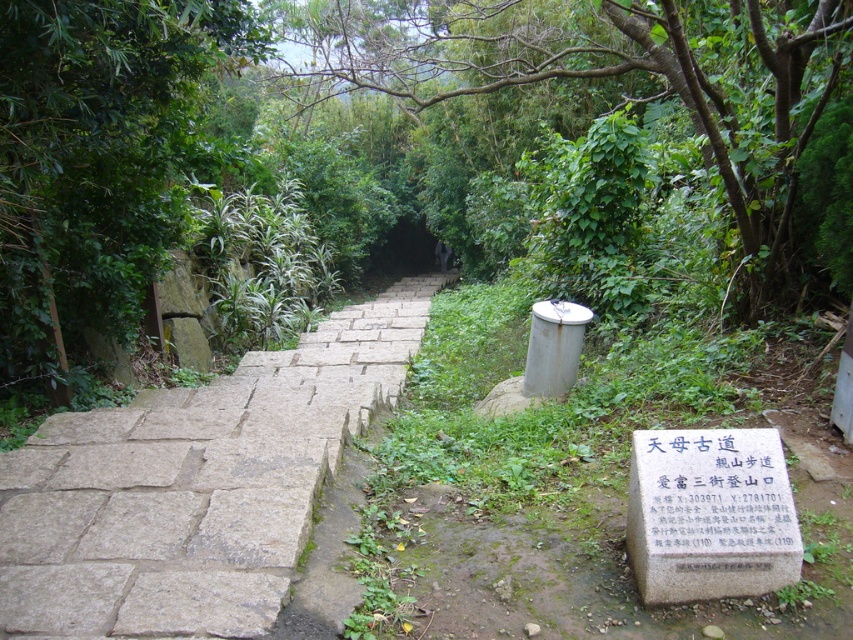
You are a hiker walking along the stone pathway and want to locate the white stone sign at lower right. According to the scene, where should you look relative to the green leafy tree at center?

The green leafy tree at center is above the white stone sign at lower right, so you should look below the green leafy tree at center to find the white stone sign at lower right.

You are walking along the stone pathway and want to reach the green leafy tree at left. Which direction should you go relative to the green leafy tree at center?

To reach the green leafy tree at left, you should go behind the green leafy tree at center since the green leafy tree at center is closer to you than the green leafy tree at left.

You are a landscape architect designing a walking path through this area. You need to place a bench between the green leafy tree at center and the green leafy tree at left. Which tree should the bench be closer to to ensure it fits within the narrower space between them?

The bench should be closer to the green leafy tree at left because it is narrower than the green leafy tree at center, so the space between them is narrower there.